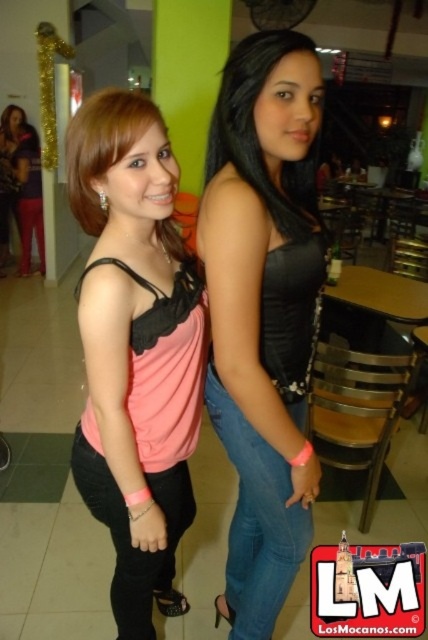
Question: Which object is closer to the camera taking this photo?

Choices:
 (A) smooth black hair at center
 (B) black matte tank top at center
 (C) pink matte tank top at center
 (D) matte purple top at left

Answer: (C)

Question: Which of the following is the closest to the observer?

Choices:
 (A) (119, 602)
 (B) (11, 188)

Answer: (A)

Question: Can you confirm if pink matte tank top at center is positioned to the right of smooth black hair at center?

Choices:
 (A) no
 (B) yes

Answer: (A)

Question: Can you confirm if smooth black hair at center is positioned below matte purple top at left?

Choices:
 (A) no
 (B) yes

Answer: (B)

Question: Is pink matte tank top at center to the left of smooth black hair at center from the viewer's perspective?

Choices:
 (A) no
 (B) yes

Answer: (B)

Question: Which of the following is the farthest from the observer?

Choices:
 (A) (302, 184)
 (B) (26, 273)

Answer: (B)